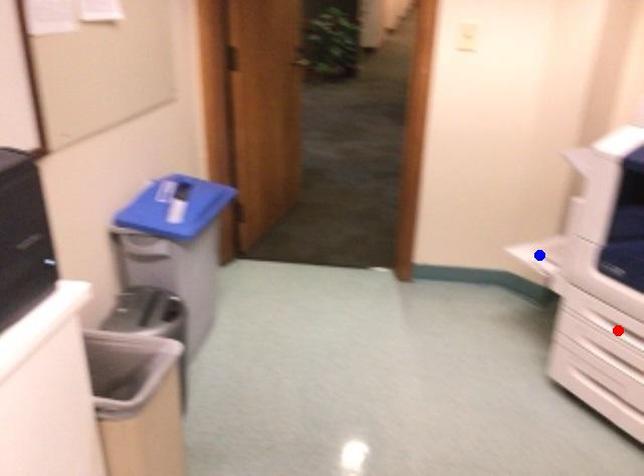
Question: Which of the two points in the image is closer to the camera?

Choices:
 (A) Blue point is closer.
 (B) Red point is closer.

Answer: (B)